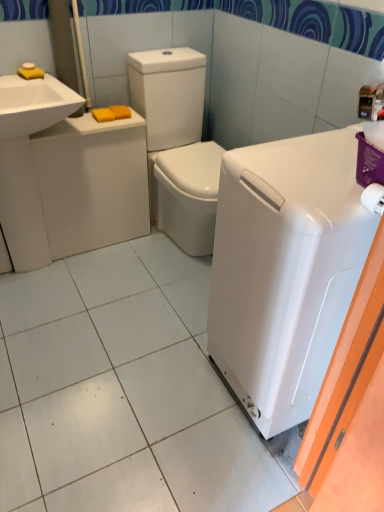
The image size is (384, 512). What do you see at coordinates (177, 145) in the screenshot? I see `white glossy washer at center` at bounding box center [177, 145].

In the scene shown: What is the approximate width of white glossy washer at center?

28.41 inches.

What do you see at coordinates (34, 104) in the screenshot?
I see `white glossy sink at upper left, the 2th sink positioned from the bottom` at bounding box center [34, 104].

Identify the location of white glossy washing machine at right. (285, 269).

Image resolution: width=384 pixels, height=512 pixels. Identify the location of white glossy sink at left, acting as the second sink starting from the top. (27, 163).

Can you tell me how much white glossy sink at upper left, the 2th sink positioned from the bottom, and white glossy washer at center differ in facing direction?

The angular difference between white glossy sink at upper left, the 2th sink positioned from the bottom, and white glossy washer at center is 0.293 degrees.

Is white glossy sink at upper left, marked as the first sink in a top-to-bottom arrangement, with white glossy washer at center?

No, white glossy sink at upper left, marked as the first sink in a top-to-bottom arrangement, is not with white glossy washer at center.

Is white glossy sink at upper left, the 2th sink positioned from the bottom, oriented away from white glossy washer at center?

No, white glossy sink at upper left, the 2th sink positioned from the bottom,'s orientation is not away from white glossy washer at center.

Looking at this image, considering the relative sizes of white glossy sink at upper left, the 2th sink positioned from the bottom, and white glossy washer at center in the image provided, is white glossy sink at upper left, the 2th sink positioned from the bottom, shorter than white glossy washer at center?

Yes, white glossy sink at upper left, the 2th sink positioned from the bottom, is shorter than white glossy washer at center.

Could you tell me if white glossy washer at center is turned towards white glossy sink at left, acting as the second sink starting from the top?

No, white glossy washer at center is not oriented towards white glossy sink at left, acting as the second sink starting from the top.

Is the depth of white glossy washer at center less than that of white glossy sink at left, acting as the second sink starting from the top?

Yes, it is in front of white glossy sink at left, acting as the second sink starting from the top.

Does white glossy washer at center touch white glossy sink at left, acting as the second sink starting from the top?

Result: No, white glossy washer at center is not in contact with white glossy sink at left, acting as the second sink starting from the top.

Is the depth of white glossy sink at left, acting as the second sink starting from the top, greater than that of white glossy washer at center?

Yes, white glossy sink at left, acting as the second sink starting from the top, is behind white glossy washer at center.

How different are the orientations of white glossy sink at left, acting as the second sink starting from the top, and white glossy washer at center in degrees?

white glossy sink at left, acting as the second sink starting from the top, and white glossy washer at center are facing 0.293 degrees away from each other.

Considering the positions of point (27, 153) and point (214, 148), is point (27, 153) closer or farther from the camera than point (214, 148)?

Clearly, point (27, 153) is closer to the camera than point (214, 148).

Is white glossy sink at left, the first sink positioned from the bottom, bigger than white glossy washer at center?

No, white glossy sink at left, the first sink positioned from the bottom, is not bigger than white glossy washer at center.

Between point (211, 292) and point (20, 226), which one is positioned in front?

Point (211, 292)

Considering the positions of objects white glossy washing machine at right and white glossy sink at left, acting as the second sink starting from the top, in the image provided, who is more to the left, white glossy washing machine at right or white glossy sink at left, acting as the second sink starting from the top,?

white glossy sink at left, acting as the second sink starting from the top, is more to the left.

From a real-world perspective, is white glossy washing machine at right located beneath white glossy sink at left, the first sink positioned from the bottom?

No, from a real-world perspective, white glossy washing machine at right is not below white glossy sink at left, the first sink positioned from the bottom.

Is white glossy washing machine at right shorter than white glossy sink at left, the first sink positioned from the bottom?

No.

Is white glossy washer at center at the back of white glossy washing machine at right?

No, white glossy washing machine at right is not facing away from white glossy washer at center.

Which is more to the left, white glossy washing machine at right or white glossy washer at center?

Positioned to the left is white glossy washer at center.

Who is smaller, white glossy washing machine at right or white glossy washer at center?

With smaller size is white glossy washing machine at right.

How different are the orientations of white glossy washer at center and white glossy sink at upper left, marked as the first sink in a top-to-bottom arrangement, in degrees?

They differ by 0.293 degrees in their facing directions.

This screenshot has height=512, width=384. I want to click on sink above the white glossy washer at center (from the image's perspective), so click(34, 104).

From the image's perspective, is white glossy washer at center above or below white glossy sink at upper left, the 2th sink positioned from the bottom?

From the image's perspective, white glossy washer at center appears below white glossy sink at upper left, the 2th sink positioned from the bottom.

Based on the photo, is white glossy sink at upper left, the 2th sink positioned from the bottom, at the back of white glossy washer at center?

No, white glossy washer at center's orientation is not away from white glossy sink at upper left, the 2th sink positioned from the bottom.

Relative to white glossy washing machine at right, is white glossy washer at center in front or behind?

In the image, white glossy washer at center appears behind white glossy washing machine at right.

Is white glossy washer at center turned away from white glossy washing machine at right?

That's not correct — white glossy washer at center is not looking away from white glossy washing machine at right.

Choose the correct answer: Is white glossy washer at center inside white glossy washing machine at right or outside it?

white glossy washer at center is spatially situated outside white glossy washing machine at right.

Which is in front, point (148, 152) or point (234, 331)?

The point (234, 331) is more forward.

This screenshot has width=384, height=512. I want to click on sink that is above the white glossy washer at center (from the image's perspective), so click(x=34, y=104).

At what (x,y) coordinates should I click in order to perform the action: click on washer to the right of white glossy sink at left, the first sink positioned from the bottom. Please return your answer as a coordinate pair (x, y). The width and height of the screenshot is (384, 512). Looking at the image, I should click on (177, 145).

Considering their positions, is white glossy sink at upper left, marked as the first sink in a top-to-bottom arrangement, positioned closer to white glossy washer at center than white glossy washing machine at right?

white glossy sink at upper left, marked as the first sink in a top-to-bottom arrangement, is closer to white glossy washer at center.

When comparing their distances from white glossy sink at upper left, the 2th sink positioned from the bottom, does white glossy washer at center or white glossy sink at left, acting as the second sink starting from the top, seem further?

white glossy washer at center lies further to white glossy sink at upper left, the 2th sink positioned from the bottom, than the other object.

Looking at the image, which one is located closer to white glossy sink at left, the first sink positioned from the bottom, white glossy sink at upper left, marked as the first sink in a top-to-bottom arrangement, or white glossy washer at center?

Among the two, white glossy sink at upper left, marked as the first sink in a top-to-bottom arrangement, is located nearer to white glossy sink at left, the first sink positioned from the bottom.

Considering their positions, is white glossy sink at left, the first sink positioned from the bottom, positioned further to white glossy washing machine at right than white glossy washer at center?

Based on the image, white glossy sink at left, the first sink positioned from the bottom, appears to be further to white glossy washing machine at right.

Considering their positions, is white glossy washing machine at right positioned further to white glossy sink at upper left, marked as the first sink in a top-to-bottom arrangement, than white glossy sink at left, the first sink positioned from the bottom?

white glossy washing machine at right.

When comparing their distances from white glossy washer at center, does white glossy washing machine at right or white glossy sink at left, the first sink positioned from the bottom, seem further?

The object further to white glossy washer at center is white glossy washing machine at right.

Considering their positions, is white glossy washing machine at right positioned closer to white glossy sink at left, the first sink positioned from the bottom, than white glossy sink at upper left, marked as the first sink in a top-to-bottom arrangement?

The object closer to white glossy sink at left, the first sink positioned from the bottom, is white glossy sink at upper left, marked as the first sink in a top-to-bottom arrangement.

Based on their spatial positions, is white glossy sink at upper left, marked as the first sink in a top-to-bottom arrangement, or white glossy washer at center further from white glossy washing machine at right?

white glossy sink at upper left, marked as the first sink in a top-to-bottom arrangement, is positioned further to the anchor white glossy washing machine at right.

Locate an element on the screen. The image size is (384, 512). sink between white glossy sink at left, the first sink positioned from the bottom, and white glossy washing machine at right, in the horizontal direction is located at coordinates (34, 104).

Where is `sink situated between white glossy sink at left, acting as the second sink starting from the top, and white glossy washer at center from left to right`? This screenshot has height=512, width=384. sink situated between white glossy sink at left, acting as the second sink starting from the top, and white glossy washer at center from left to right is located at coordinates (34, 104).

Where is `washer between white glossy sink at left, acting as the second sink starting from the top, and white glossy washing machine at right`? The image size is (384, 512). washer between white glossy sink at left, acting as the second sink starting from the top, and white glossy washing machine at right is located at coordinates (177, 145).

At what (x,y) coordinates should I click in order to perform the action: click on washer located between white glossy sink at upper left, the 2th sink positioned from the bottom, and white glossy washing machine at right in the left-right direction. Please return your answer as a coordinate pair (x, y). Image resolution: width=384 pixels, height=512 pixels. Looking at the image, I should click on (177, 145).